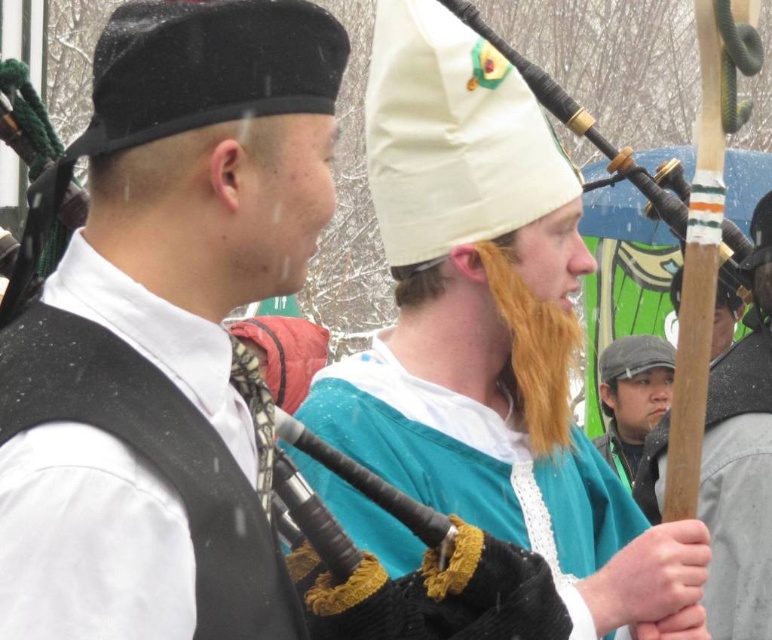
You are an observer in the scene. You see the white cloth hat at center and the wooden stick at center. Which object is located above the other?

The white cloth hat at center is positioned over the wooden stick at center, so it is above it.

Consider the image. You are standing in the snowy background of the image and want to reach the wooden stick at center. Which direction should you move to get closer to it?

The wooden stick at center is located at point coordinates 0.723 on the x axis and 0.961 on the y axis. Since you are in the snowy background, you should move towards the center of the image to reach it.